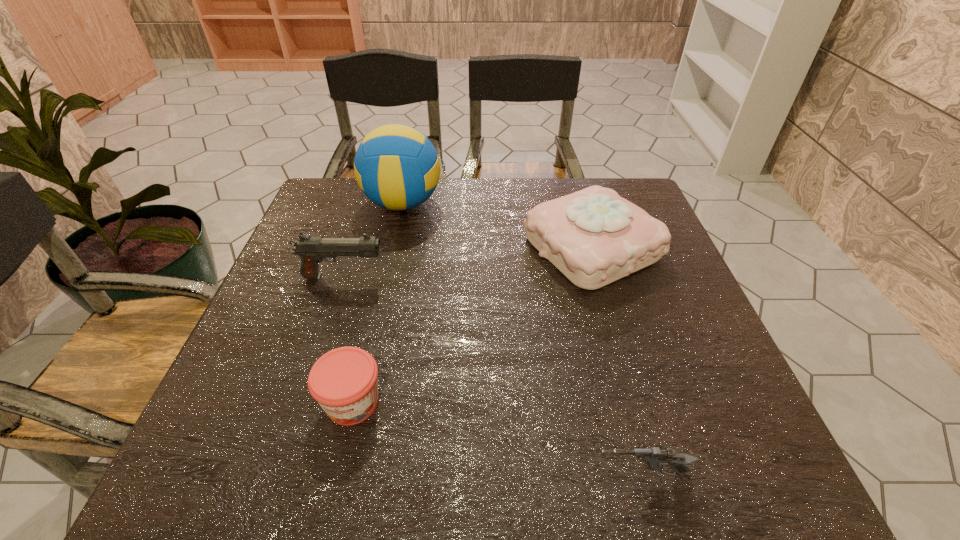
You are a GUI agent. You are given a task and a screenshot of the screen. Output one action in this format:
    pyautogui.click(x=<x>, y=<y>)
    Task: Click on the cake present at the right edge
    The width and height of the screenshot is (960, 540).
    Given the screenshot: What is the action you would take?
    pyautogui.click(x=594, y=237)

Image resolution: width=960 pixels, height=540 pixels. What are the coordinates of `gun positioned at the right edge` in the screenshot? It's located at (655, 458).

Identify the location of object that is at the far left corner. (396, 166).

Where is `object located in the far right corner section of the desktop`? object located in the far right corner section of the desktop is located at coordinates (594, 237).

Identify the location of object that is at the near right corner. (655, 458).

Locate an element on the screen. The image size is (960, 540). vacant space at the far edge of the desktop is located at coordinates (375, 214).

Find the location of `vacant area at the near edge`. vacant area at the near edge is located at coordinates (290, 474).

Locate an element on the screen. free space at the left edge of the desktop is located at coordinates (278, 316).

What are the coordinates of `free space at the right edge of the desktop` in the screenshot? It's located at (737, 428).

In the image, there is a desktop. At what (x,y) coordinates should I click in order to perform the action: click on vacant space at the far left corner. Please return your answer as a coordinate pair (x, y). The height and width of the screenshot is (540, 960). Looking at the image, I should click on (329, 203).